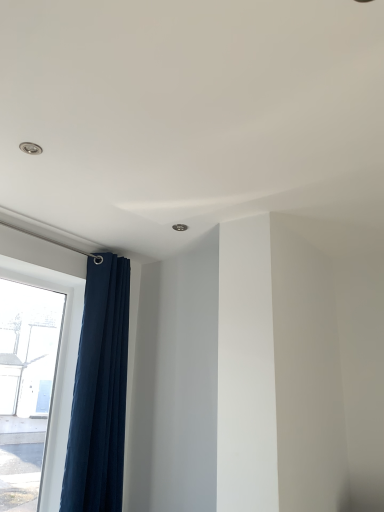
Describe the element at coordinates (99, 392) in the screenshot. This screenshot has height=512, width=384. I see `dark blue fabric curtain at left` at that location.

This screenshot has width=384, height=512. I want to click on dark blue fabric curtain at left, so click(99, 392).

What is the approximate height of transparent glass window at left?

It is 4.53 feet.

The width and height of the screenshot is (384, 512). What do you see at coordinates (40, 260) in the screenshot?
I see `transparent glass window at left` at bounding box center [40, 260].

Find the location of a particular element. The height and width of the screenshot is (512, 384). transparent glass window at left is located at coordinates (40, 260).

Where is `dark blue fabric curtain at left`? The width and height of the screenshot is (384, 512). dark blue fabric curtain at left is located at coordinates [99, 392].

Does dark blue fabric curtain at left appear on the left side of transparent glass window at left?

Incorrect, dark blue fabric curtain at left is not on the left side of transparent glass window at left.

From the picture: Considering their positions, is dark blue fabric curtain at left located in front of or behind transparent glass window at left?

dark blue fabric curtain at left is behind transparent glass window at left.

Does point (108, 330) come farther from viewer compared to point (48, 500)?

Yes, point (108, 330) is behind point (48, 500).

From the image's perspective, is dark blue fabric curtain at left above or below transparent glass window at left?

Based on their image positions, dark blue fabric curtain at left is located above transparent glass window at left.

From a real-world perspective, is dark blue fabric curtain at left located higher than transparent glass window at left?

Yes, from a real-world perspective, dark blue fabric curtain at left is on top of transparent glass window at left.

Considering the sizes of objects dark blue fabric curtain at left and transparent glass window at left in the image provided, who is wider, dark blue fabric curtain at left or transparent glass window at left?

Wider between the two is dark blue fabric curtain at left.

Considering the sizes of dark blue fabric curtain at left and transparent glass window at left in the image, is dark blue fabric curtain at left taller or shorter than transparent glass window at left?

Clearly, dark blue fabric curtain at left is taller compared to transparent glass window at left.

Considering the sizes of objects dark blue fabric curtain at left and transparent glass window at left in the image provided, who is smaller, dark blue fabric curtain at left or transparent glass window at left?

transparent glass window at left is smaller.

Is dark blue fabric curtain at left inside the boundaries of transparent glass window at left, or outside?

dark blue fabric curtain at left is located beyond the bounds of transparent glass window at left.

Are dark blue fabric curtain at left and transparent glass window at left far apart?

That's not correct — dark blue fabric curtain at left is a little close to transparent glass window at left.

Is dark blue fabric curtain at left facing towards transparent glass window at left?

No.

This screenshot has width=384, height=512. Identify the location of window lying in front of the dark blue fabric curtain at left. (40, 260).

Which object is positioned more to the left, transparent glass window at left or dark blue fabric curtain at left?

transparent glass window at left.

Which object is further away from the camera taking this photo, transparent glass window at left or dark blue fabric curtain at left?

dark blue fabric curtain at left is further from the camera.

Is point (65, 277) more distant than point (87, 406)?

Yes, it is.

From the image's perspective, relative to dark blue fabric curtain at left, is transparent glass window at left above or below?

transparent glass window at left is below dark blue fabric curtain at left.

From the picture: From a real-world perspective, which is physically below, transparent glass window at left or dark blue fabric curtain at left?

In real-world perspective, transparent glass window at left is lower.

Considering the relative sizes of transparent glass window at left and dark blue fabric curtain at left in the image provided, is transparent glass window at left wider than dark blue fabric curtain at left?

In fact, transparent glass window at left might be narrower than dark blue fabric curtain at left.

Does transparent glass window at left have a greater height compared to dark blue fabric curtain at left?

No.

Can you confirm if transparent glass window at left is bigger than dark blue fabric curtain at left?

No.

Is transparent glass window at left positioned beyond the bounds of dark blue fabric curtain at left?

That's correct, transparent glass window at left is outside of dark blue fabric curtain at left.

Can you see transparent glass window at left touching dark blue fabric curtain at left?

transparent glass window at left and dark blue fabric curtain at left are not in contact.

Does transparent glass window at left turn towards dark blue fabric curtain at left?

Yes, transparent glass window at left is oriented towards dark blue fabric curtain at left.

What's the angular difference between transparent glass window at left and dark blue fabric curtain at left's facing directions?

0.00285 degrees.

How distant is transparent glass window at left from dark blue fabric curtain at left?

The distance of transparent glass window at left from dark blue fabric curtain at left is 9.10 inches.

Identify the location of curtain on the right side of transparent glass window at left. The width and height of the screenshot is (384, 512). (99, 392).

Where is `curtain on the right of the transparent glass window at left`? Image resolution: width=384 pixels, height=512 pixels. curtain on the right of the transparent glass window at left is located at coordinates (99, 392).

The width and height of the screenshot is (384, 512). Find the location of `curtain that is above the transparent glass window at left (from the image's perspective)`. curtain that is above the transparent glass window at left (from the image's perspective) is located at coordinates (99, 392).